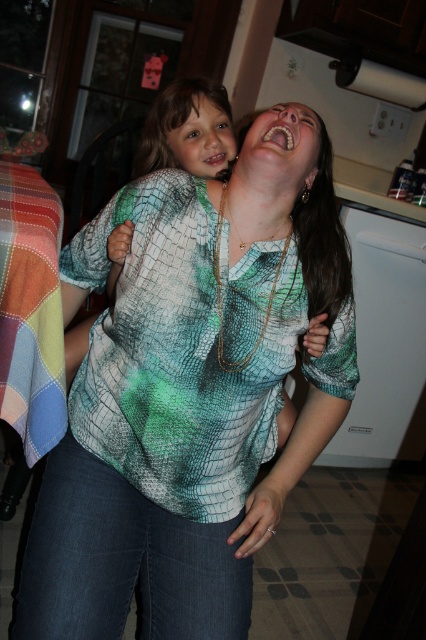
Question: Is green printed blouse at center to the right of matte green shirt at upper center from the viewer's perspective?

Choices:
 (A) no
 (B) yes

Answer: (B)

Question: From the image, what is the correct spatial relationship of green printed blouse at center in relation to matte green shirt at upper center?

Choices:
 (A) left
 (B) right

Answer: (B)

Question: Which point is farther from the camera taking this photo?

Choices:
 (A) tap(181, 108)
 (B) tap(293, 476)
 (C) tap(152, 136)

Answer: (C)

Question: Is green printed blouse at center behind matte green shirt at upper center?

Choices:
 (A) no
 (B) yes

Answer: (A)

Question: Which point is farther to the camera?

Choices:
 (A) (204, 176)
 (B) (143, 156)
 (C) (104, 444)

Answer: (B)

Question: Which of these objects is positioned farthest from the matte green shirt at upper center?

Choices:
 (A) printed fabric shirt at center
 (B) green printed blouse at center

Answer: (B)